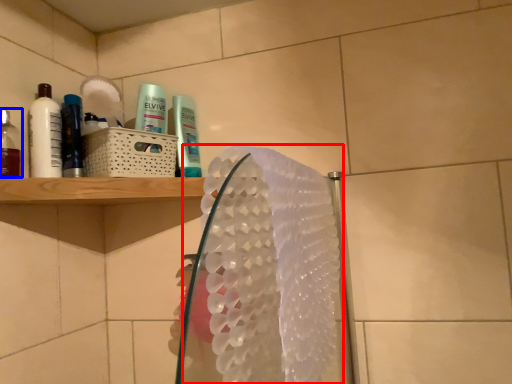
Question: Which point is further to the camera, hand towel (highlighted by a red box) or mouthwash (highlighted by a blue box)?

Choices:
 (A) hand towel
 (B) mouthwash

Answer: (B)